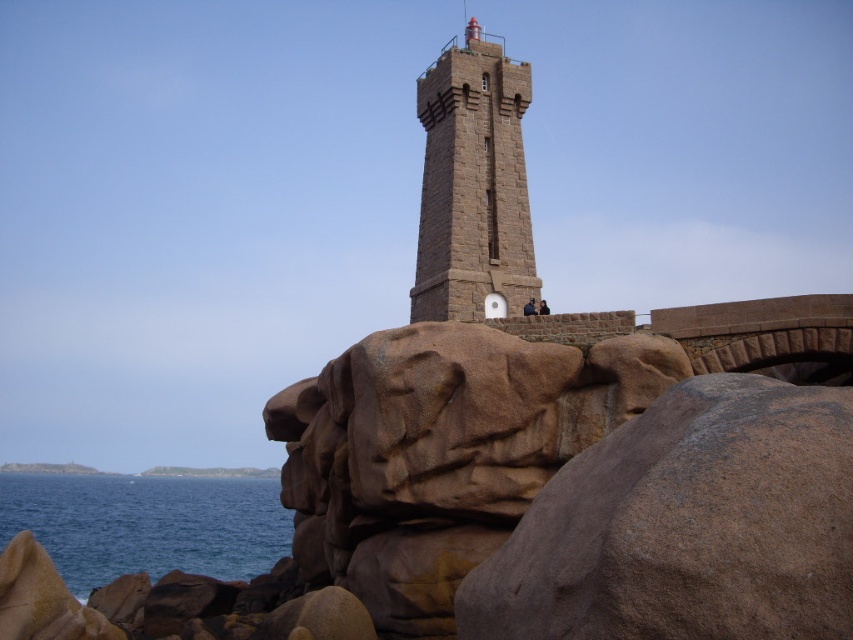
Question: Which object appears closest to the camera in this image?

Choices:
 (A) brown stone tower at center
 (B) blue water at lower left

Answer: (A)

Question: Which of the following is the closest to the observer?

Choices:
 (A) (456, 230)
 (B) (225, 568)

Answer: (A)

Question: Does brown stone tower at center lie behind blue water at lower left?

Choices:
 (A) yes
 (B) no

Answer: (B)

Question: Is brown stone tower at center to the left of blue water at lower left from the viewer's perspective?

Choices:
 (A) yes
 (B) no

Answer: (B)

Question: In this image, where is brown stone tower at center located relative to blue water at lower left?

Choices:
 (A) left
 (B) right

Answer: (B)